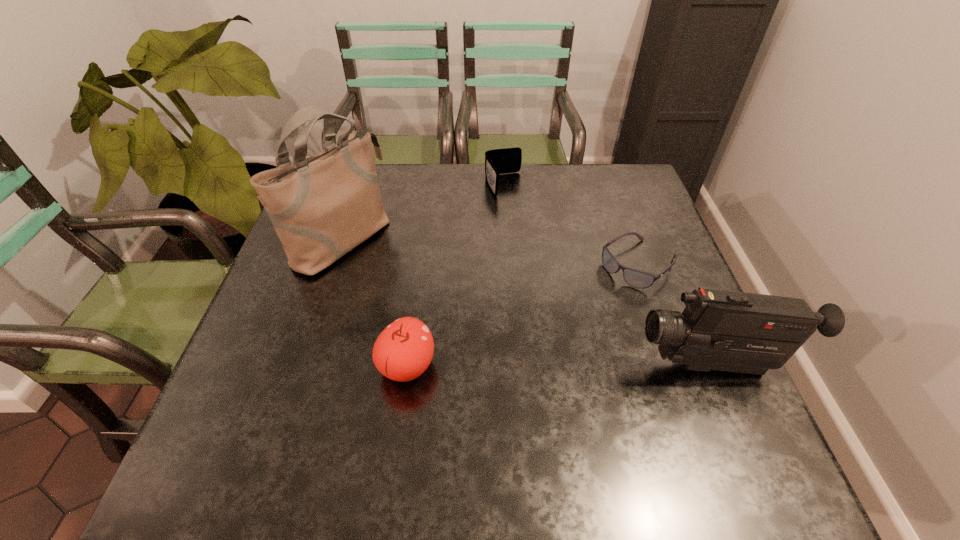
The width and height of the screenshot is (960, 540). Find the location of `free space between the sunglasses and the wallet`. free space between the sunglasses and the wallet is located at coordinates (571, 225).

Identify which object is located as the nearest to the apple. Please provide its 2D coordinates. Your answer should be formatted as a tuple, i.e. [(x, y)], where the tuple contains the x and y coordinates of a point satisfying the conditions above.

[(323, 206)]

At what (x,y) coordinates should I click in order to perform the action: click on object that is the third closest to the sunglasses. Please return your answer as a coordinate pair (x, y). The height and width of the screenshot is (540, 960). Looking at the image, I should click on (404, 349).

This screenshot has height=540, width=960. What are the coordinates of `vacant position in the image that satisfies the following two spatial constraints: 1. on the front side of the sunglasses; 2. on the right side of the third object from right to left` in the screenshot? It's located at (509, 265).

You are a GUI agent. You are given a task and a screenshot of the screen. Output one action in this format:
    pyautogui.click(x=<x>, y=<y>)
    Task: Click on the vacant space that satisfies the following two spatial constraints: 1. on the front side of the leftmost object; 2. on the front-facing side of the second tallest object
    
    Given the screenshot: What is the action you would take?
    pyautogui.click(x=300, y=366)

Find the location of a particular element. Image resolution: width=960 pixels, height=540 pixels. vacant region that satisfies the following two spatial constraints: 1. on the front side of the second tallest object; 2. on the front-facing side of the farthest object is located at coordinates (516, 366).

Locate an element on the screen. This screenshot has width=960, height=540. vacant space that satisfies the following two spatial constraints: 1. on the front side of the shortest object; 2. on the left side of the third object from right to left is located at coordinates (509, 265).